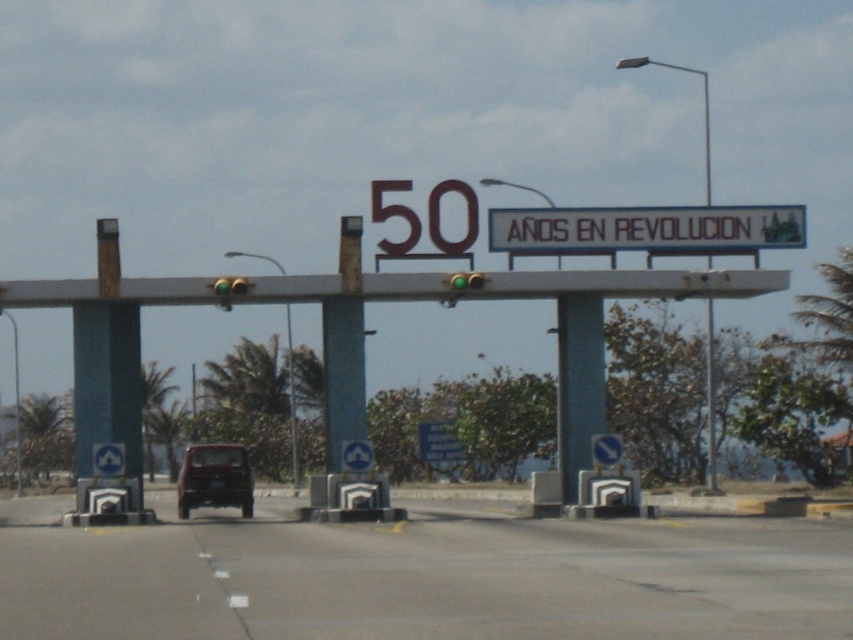
Question: Is green glossy signpost at left further to the viewer compared to shiny red car at center?

Choices:
 (A) no
 (B) yes

Answer: (A)

Question: Does white plastic sign at center appear on the right side of shiny red car at center?

Choices:
 (A) no
 (B) yes

Answer: (B)

Question: Where is metallic gray overpass at center located in relation to green glossy signpost at left in the image?

Choices:
 (A) right
 (B) left

Answer: (A)

Question: Which is nearer to the blue concrete pillar at center?

Choices:
 (A) white plastic sign at center
 (B) metallic gray overpass at center
 (C) green glossy signpost at left
 (D) shiny red car at center

Answer: (B)

Question: Which of the following is the closest to the observer?

Choices:
 (A) (514, 212)
 (B) (202, 468)
 (C) (619, 272)

Answer: (C)

Question: Which is farther from the metallic gray overpass at center?

Choices:
 (A) shiny red car at center
 (B) blue concrete pillar at center
 (C) green glossy signpost at left

Answer: (A)